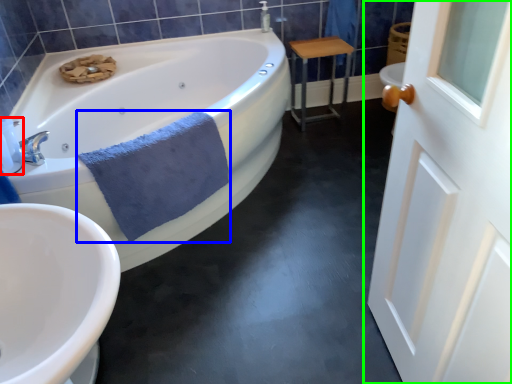
Question: Which is nearer to the toiletry (highlighted by a red box)? bath towel (highlighted by a blue box) or door (highlighted by a green box).

Choices:
 (A) bath towel
 (B) door

Answer: (A)